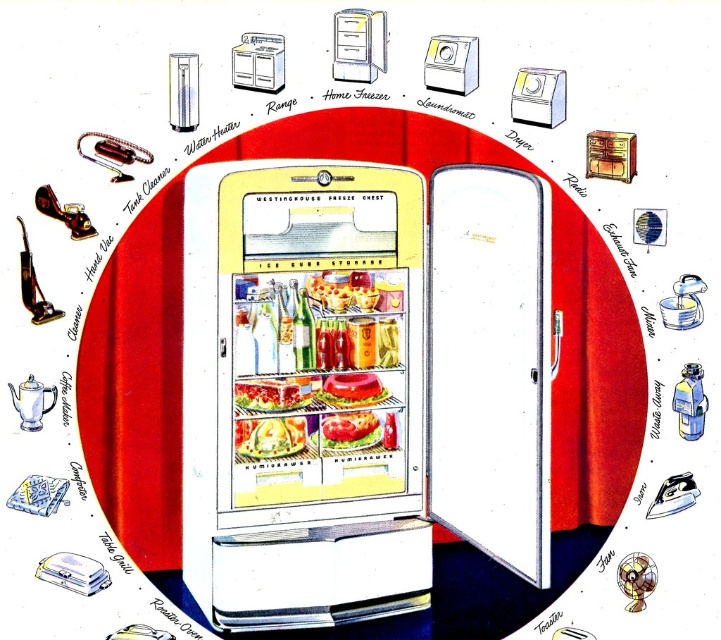
Looking at this image, can you confirm if matte white washing machine at upper center is wider than shiny plastic sandwich at center?

In fact, matte white washing machine at upper center might be narrower than shiny plastic sandwich at center.

Is matte white washing machine at upper center further to camera compared to shiny plastic sandwich at center?

No, it is in front of shiny plastic sandwich at center.

This screenshot has width=721, height=640. I want to click on matte white washing machine at upper center, so click(x=451, y=64).

Identify the location of matte white washing machine at upper center. The height and width of the screenshot is (640, 721). (451, 64).

Which of these two, translucent plastic salad bowl at center or translucent plastic container at center, stands shorter?

translucent plastic container at center

This screenshot has width=721, height=640. In order to click on translucent plastic salad bowl at center in this screenshot , I will do 269,436.

Which is in front, point (267, 429) or point (293, 401)?

Point (267, 429) is in front.

This screenshot has width=721, height=640. What are the coordinates of `translucent plastic salad bowl at center` in the screenshot? It's located at (269, 436).

Between metallic silver range at upper left and translucent plastic container at center, which one has more height?

With more height is metallic silver range at upper left.

Is metallic silver range at upper left smaller than translucent plastic container at center?

Correct, metallic silver range at upper left occupies less space than translucent plastic container at center.

Where is `metallic silver range at upper left`? metallic silver range at upper left is located at coordinates (257, 61).